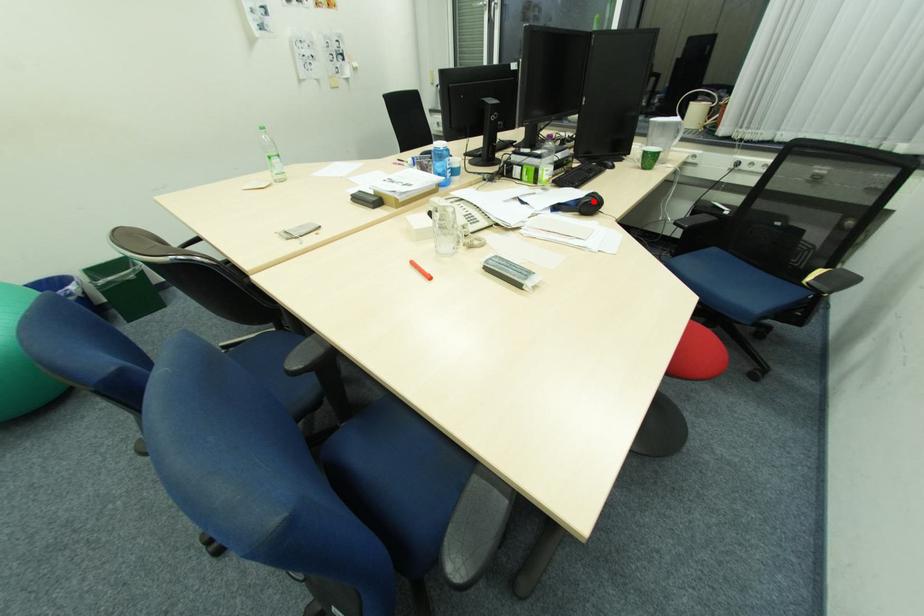
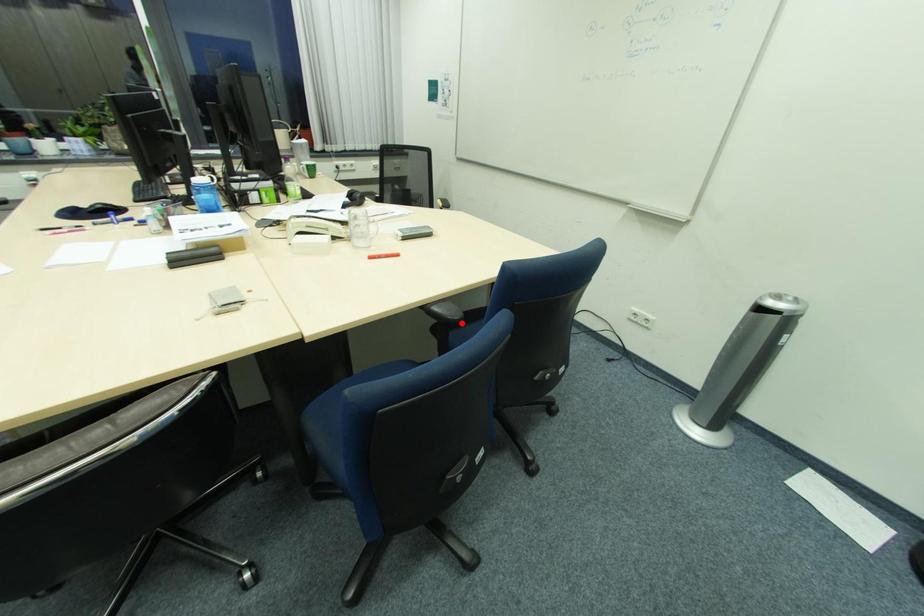
I am providing you with two images of the same scene from different viewpoints. A red point is marked on the first image and another point is marked on the second image. Is the red point in image1 aligned with the point shown in image2?

No